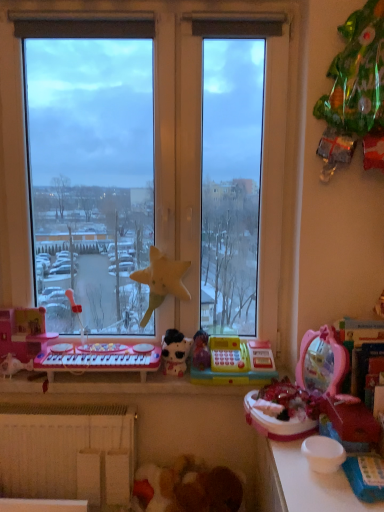
At what (x,y) coordinates should I click in order to perform the action: click on blank space above pink plastic musical keyboard at lower left (from a real-world perspective). Please return your answer as a coordinate pair (x, y). The image size is (384, 512). Looking at the image, I should click on (108, 347).